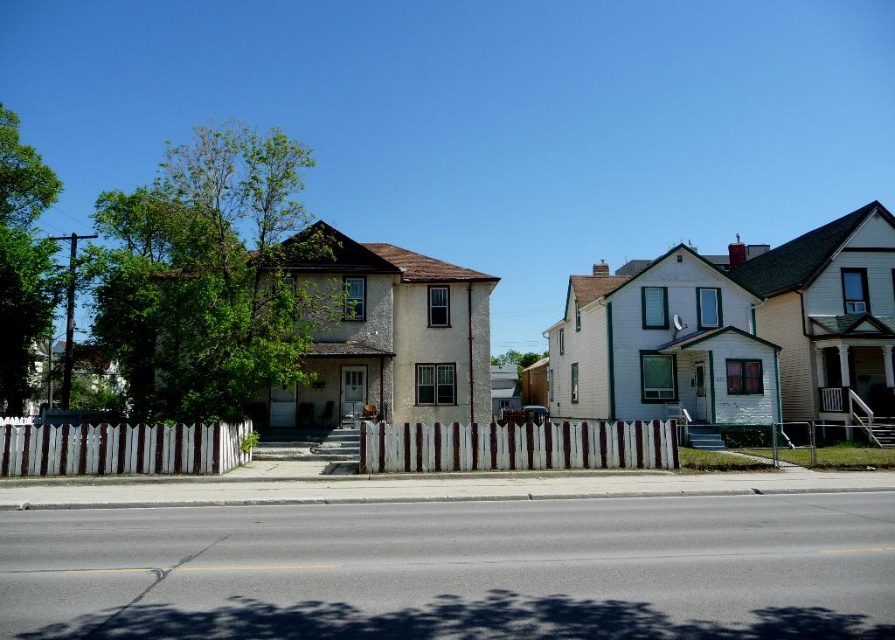
You are a delivery person trying to find the correct house. You see the white wood fence at center and the white picket fence at lower left. How far apart are these two fences?

The white wood fence at center and the white picket fence at lower left are 19.83 feet apart.

Consider the image. You are standing at the center of the road and want to walk to the white wood fence at center. Which direction should you walk?

The white wood fence at center is located at coordinates (517, 445), so you should walk towards the center of the scene to reach it.